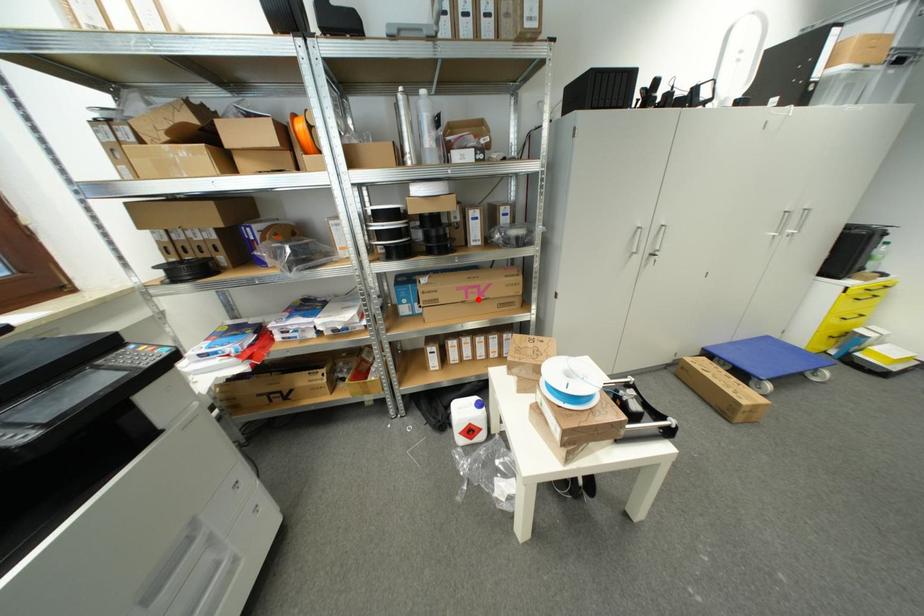
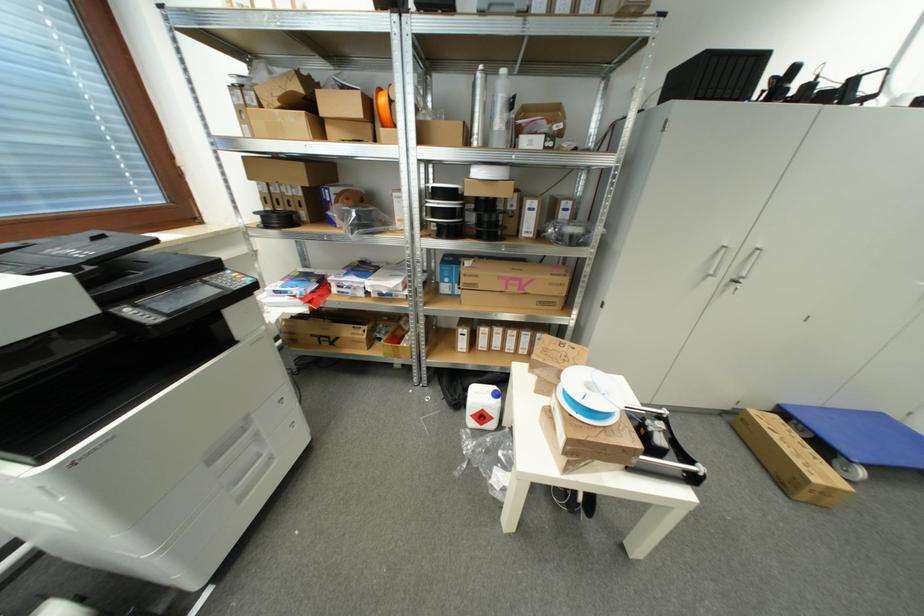
In the second image, find the point that corresponds to the highlighted location in the first image.

(517, 292)